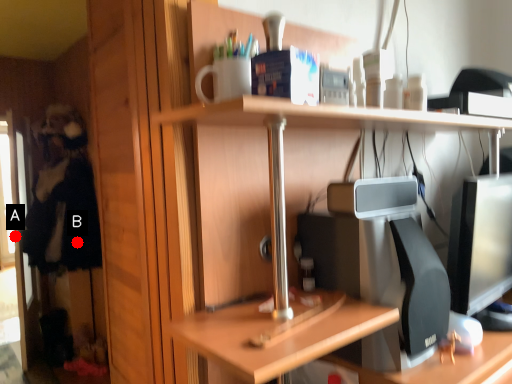
Question: Two points are circled on the image, labeled by A and B beside each circle. Which point appears farthest from the camera in this image?

Choices:
 (A) A is further
 (B) B is further

Answer: (A)